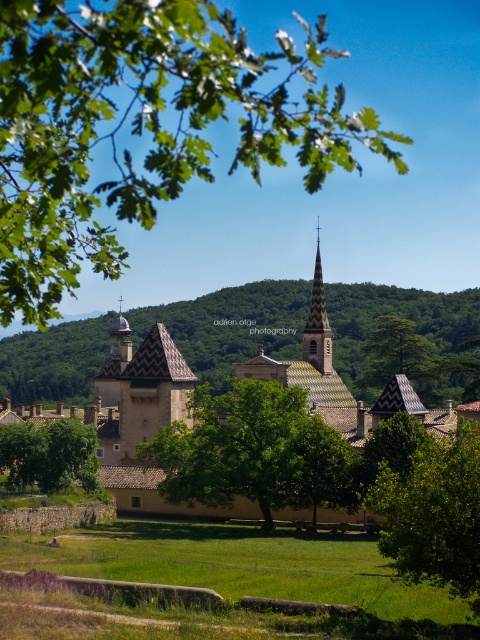
You are standing in front of the historic building and want to take a photo that includes both the green leafy tree at lower right and the green textured tree at center. Which tree should you position closer to the camera to ensure both are in the frame?

You should position the green leafy tree at lower right closer to the camera since it is already closer to the viewer than the green textured tree at center, ensuring both are in the frame.

Based on the photo, you are standing in front of the historic building and want to take a photo that includes both the green leafy branch at upper left and the green leafy tree at center. Which one will appear larger in the photo?

The green leafy branch at upper left will appear larger in the photo because it is closer to the viewer than the green leafy tree at center.

You are a tourist standing in front of the historic building with the black and yellow roof tiles. You notice two green leafy trees in the scene. Which tree, the green leafy tree at center or the green leafy tree at lower right, is taller?

The green leafy tree at center is taller than the green leafy tree at lower right.